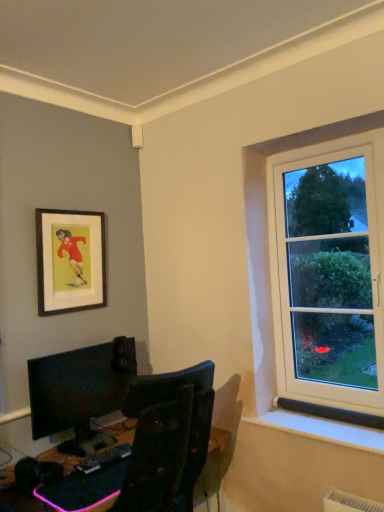
The height and width of the screenshot is (512, 384). What do you see at coordinates (213, 465) in the screenshot?
I see `black plastic desk at lower left` at bounding box center [213, 465].

At what (x,y) coordinates should I click in order to perform the action: click on matte black monitor at lower left. Please return your answer as a coordinate pair (x, y). This screenshot has height=512, width=384. Looking at the image, I should click on (79, 386).

Find the location of a particular element. The height and width of the screenshot is (512, 384). black plastic desk at lower left is located at coordinates (213, 465).

Is wooden framed poster at upper left looking in the opposite direction of black plastic keyboard at lower center?

No.

Does point (64, 311) lie in front of point (99, 457)?

No.

In terms of height, does wooden framed poster at upper left look taller or shorter compared to black plastic keyboard at lower center?

wooden framed poster at upper left is taller than black plastic keyboard at lower center.

Based on the photo, is wooden framed poster at upper left smaller than black plastic desk at lower left?

Indeed, wooden framed poster at upper left has a smaller size compared to black plastic desk at lower left.

Does point (89, 282) appear closer or farther from the camera than point (16, 431)?

Point (89, 282).

Are wooden framed poster at upper left and black plastic desk at lower left making contact?

No, wooden framed poster at upper left is not making contact with black plastic desk at lower left.

This screenshot has width=384, height=512. Identify the location of desk below the wooden framed poster at upper left (from a real-world perspective). (213, 465).

Can you see matte black monitor at lower left touching wooden framed poster at upper left?

matte black monitor at lower left is not next to wooden framed poster at upper left, and they're not touching.

Is matte black monitor at lower left facing towards wooden framed poster at upper left?

No, matte black monitor at lower left is not turned towards wooden framed poster at upper left.

Can you confirm if matte black monitor at lower left is smaller than wooden framed poster at upper left?

Incorrect, matte black monitor at lower left is not smaller in size than wooden framed poster at upper left.

This screenshot has width=384, height=512. In order to click on picture frame on the left of black plastic desk at lower left in this screenshot , I will do `click(70, 261)`.

Which is behind, point (41, 505) or point (68, 245)?

The point (68, 245) is behind.

Is black plastic desk at lower left not within wooden framed poster at upper left?

Yes, black plastic desk at lower left is outside of wooden framed poster at upper left.

Can you tell me how much black plastic desk at lower left and wooden framed poster at upper left differ in facing direction?

They differ by 0.00353 degrees in their facing directions.

Between black plastic desk at lower left and black plastic keyboard at lower center, which one has less height?

Standing shorter between the two is black plastic keyboard at lower center.

Which object is closer to the camera, black plastic desk at lower left or black plastic keyboard at lower center?

black plastic desk at lower left.

Which of these two, black plastic desk at lower left or black plastic keyboard at lower center, is bigger?

Bigger between the two is black plastic desk at lower left.

Is the surface of black plastic desk at lower left in direct contact with black plastic keyboard at lower center?

No, black plastic desk at lower left is not beside black plastic keyboard at lower center.

Is black plastic keyboard at lower center inside the boundaries of matte black monitor at lower left, or outside?

black plastic keyboard at lower center is not inside matte black monitor at lower left, it's outside.

From the image's perspective, is black plastic keyboard at lower center located above or below matte black monitor at lower left?

Clearly, from the image's perspective, black plastic keyboard at lower center is below matte black monitor at lower left.

What's the angular difference between black plastic keyboard at lower center and matte black monitor at lower left's facing directions?

There is a 0.00424-degree angle between the facing directions of black plastic keyboard at lower center and matte black monitor at lower left.

In the scene shown: Does black plastic keyboard at lower center have a greater width compared to black plastic desk at lower left?

No.

From a real-world perspective, is black plastic keyboard at lower center positioned above or below black plastic desk at lower left?

black plastic keyboard at lower center is situated higher than black plastic desk at lower left in the real world.

Considering the positions of objects black plastic keyboard at lower center and black plastic desk at lower left in the image provided, who is in front, black plastic keyboard at lower center or black plastic desk at lower left?

Positioned in front is black plastic desk at lower left.

What's the angular difference between black plastic keyboard at lower center and black plastic desk at lower left's facing directions?

0.00019 degrees.

Locate an element on the screen. This screenshot has height=512, width=384. computer keyboard on the right of the wooden framed poster at upper left is located at coordinates (104, 459).

Locate an element on the screen. The height and width of the screenshot is (512, 384). picture frame located above the black plastic desk at lower left (from a real-world perspective) is located at coordinates (70, 261).

Looking at the image, which one is located further to matte black monitor at lower left, wooden framed poster at upper left or black plastic keyboard at lower center?

wooden framed poster at upper left lies further to matte black monitor at lower left than the other object.

Looking at the image, which one is located closer to black plastic keyboard at lower center, matte black monitor at lower left or wooden framed poster at upper left?

matte black monitor at lower left is positioned closer to the anchor black plastic keyboard at lower center.

Based on their spatial positions, is black plastic keyboard at lower center or wooden framed poster at upper left closer to matte black monitor at lower left?

The object closer to matte black monitor at lower left is black plastic keyboard at lower center.

When comparing their distances from black plastic keyboard at lower center, does wooden framed poster at upper left or black plastic desk at lower left seem further?

wooden framed poster at upper left is further to black plastic keyboard at lower center.

Based on their spatial positions, is black plastic keyboard at lower center or black plastic desk at lower left further from wooden framed poster at upper left?

black plastic keyboard at lower center is further to wooden framed poster at upper left.

From the image, which object appears to be nearer to black plastic keyboard at lower center, black plastic desk at lower left or matte black monitor at lower left?

black plastic desk at lower left.

When comparing their distances from black plastic keyboard at lower center, does wooden framed poster at upper left or matte black monitor at lower left seem further?

wooden framed poster at upper left is positioned further to the anchor black plastic keyboard at lower center.

Estimate the real-world distances between objects in this image. Which object is closer to matte black monitor at lower left, black plastic keyboard at lower center or black plastic desk at lower left?

Based on the image, black plastic desk at lower left appears to be nearer to matte black monitor at lower left.

The height and width of the screenshot is (512, 384). Find the location of `computer monitor between wooden framed poster at upper left and black plastic desk at lower left in the up-down direction`. computer monitor between wooden framed poster at upper left and black plastic desk at lower left in the up-down direction is located at coordinates (79, 386).

Identify the location of computer monitor that lies between wooden framed poster at upper left and black plastic keyboard at lower center from top to bottom. This screenshot has width=384, height=512. (79, 386).

Find the location of a particular element. computer keyboard between wooden framed poster at upper left and black plastic desk at lower left from top to bottom is located at coordinates (104, 459).

At what (x,y) coordinates should I click in order to perform the action: click on computer keyboard positioned between black plastic desk at lower left and matte black monitor at lower left from near to far. Please return your answer as a coordinate pair (x, y). Looking at the image, I should click on (104, 459).